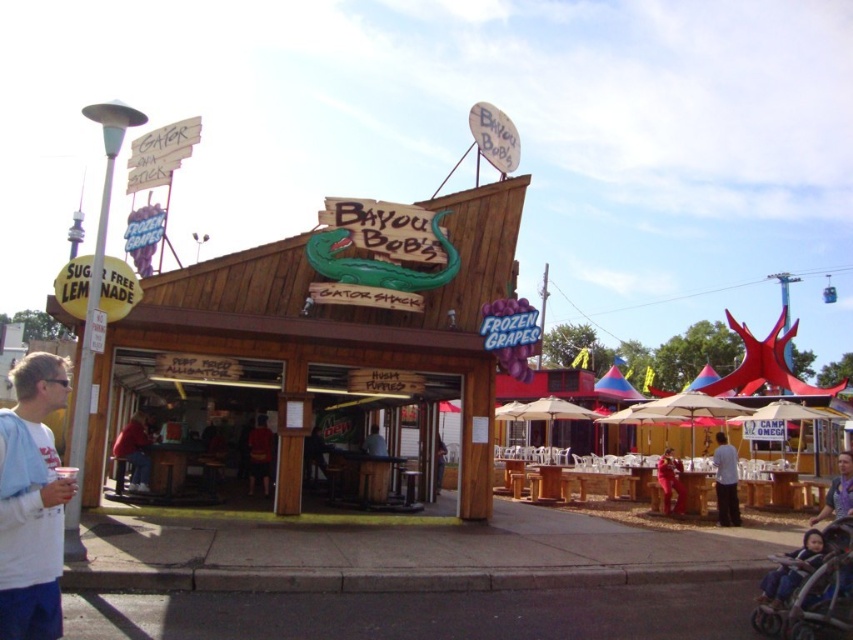
You are standing at the entrance of Bayou Bob Gator Shack and want to greet both the person wearing the red fabric shirt at center and the person wearing the yellow fabric shirt at lower right. If you walk straight ahead, which direction should you face to first reach the closer one?

The red fabric shirt at center is closer to you than the yellow fabric shirt at lower right, so you should face the direction of the red fabric shirt at center first.

You are a customer at Bayou Bob Gator Shack. You see two staff members wearing the light gray fabric shirt at center and the yellow fabric shirt at lower right. Which staff member is wearing a smaller shirt?

The light gray fabric shirt at center is smaller than the yellow fabric shirt at lower right.